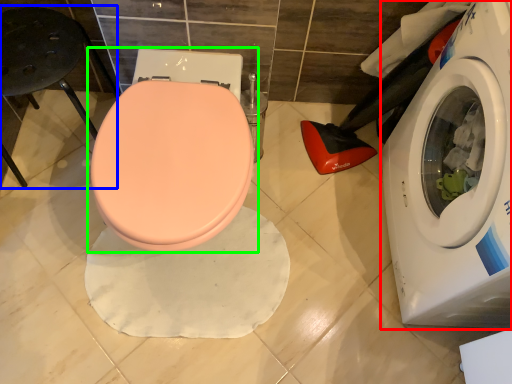
Question: Which object is positioned farthest from washing machine (highlighted by a red box)? Select from bar stool (highlighted by a blue box) and toilet (highlighted by a green box).

Choices:
 (A) bar stool
 (B) toilet

Answer: (A)